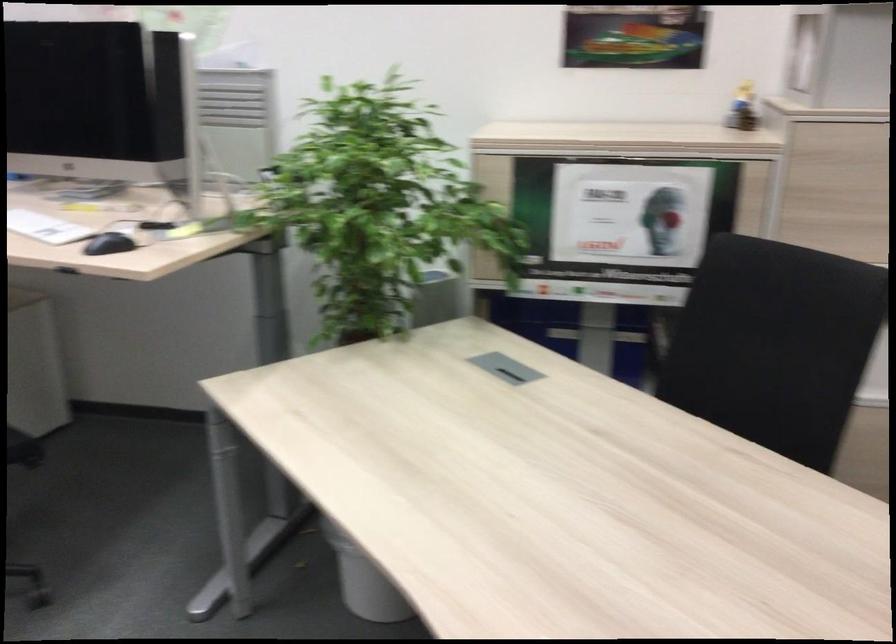
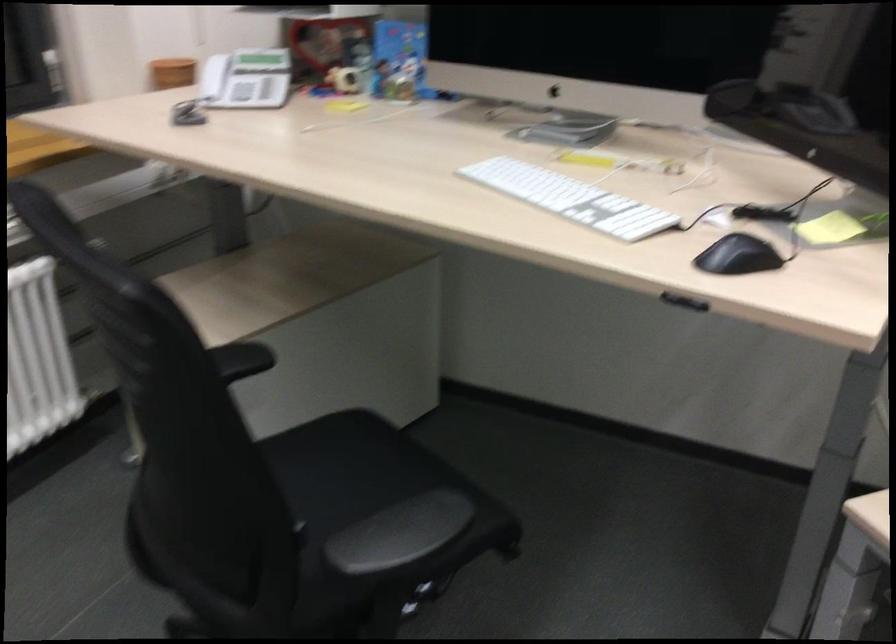
In a continuous first-person perspective shot, in which direction is the camera moving?

The cameraman moved toward left, forward.